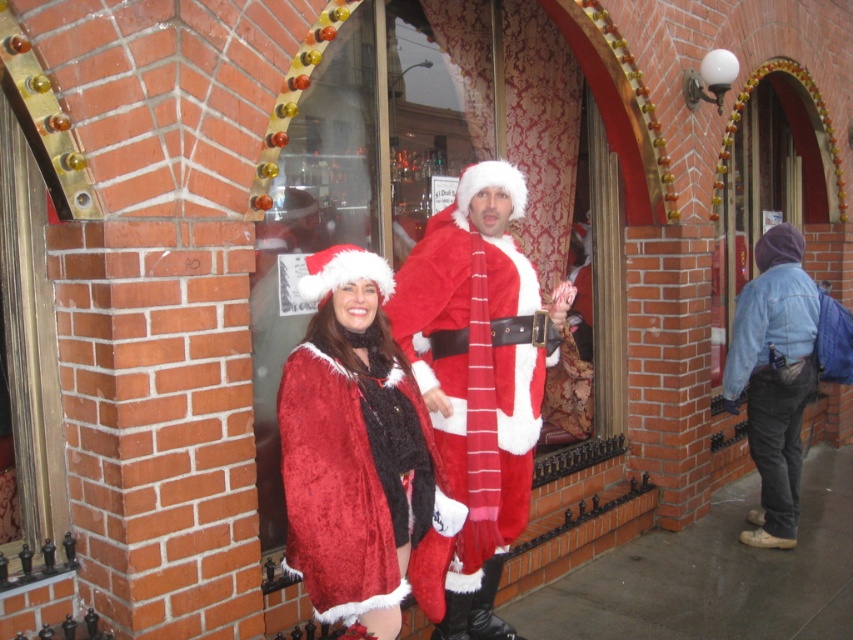
Question: Which object is closer to the camera taking this photo?

Choices:
 (A) fuzzy red coat at center
 (B) fuzzy red santa suit at center
 (C) velvet santa suit at center
 (D) denim jacket at lower right

Answer: (A)

Question: Which point is farther from the camera taking this photo?

Choices:
 (A) (814, 321)
 (B) (318, 298)
 (C) (357, 113)

Answer: (A)

Question: Does fuzzy red santa suit at center have a larger size compared to denim jacket at lower right?

Choices:
 (A) yes
 (B) no

Answer: (B)

Question: From the image, what is the correct spatial relationship of velvet santa suit at center in relation to fuzzy red coat at center?

Choices:
 (A) left
 (B) right

Answer: (B)

Question: Is velvet santa suit at center to the right of denim jacket at lower right from the viewer's perspective?

Choices:
 (A) no
 (B) yes

Answer: (A)

Question: Which of the following is the closest to the observer?

Choices:
 (A) (299, 179)
 (B) (537, 438)

Answer: (B)